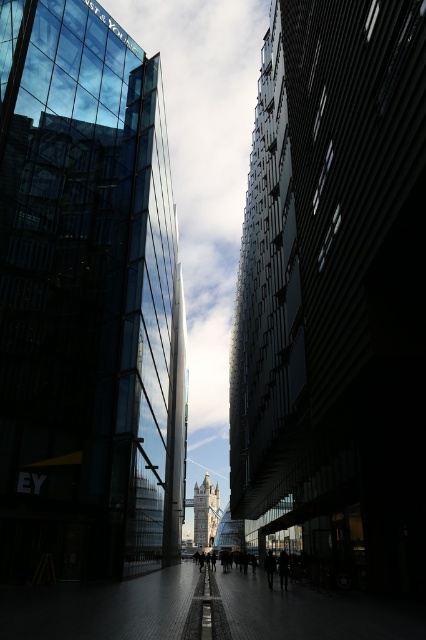
You are standing between two tall buildings and looking up. There are two points marked in the scene, point (285, 564) and point (271, 556). Which point is closer to you?

Point (285, 564) is closer to the viewer than point (271, 556).

You are standing on the sidewalk in front of the dark glass skyscraper at center. You want to take a photo of it with your smartphone, which has a maximum focus distance of 100 feet. Will your phone be able to focus on the skyscraper?

The dark glass skyscraper at center is 151.15 feet away from the viewer. Since the phone has a maximum focus distance of 100 feet, it cannot focus on the skyscraper at this distance.

You are a photographer standing at the base of the transparent glass tower at center. You want to take a photo of the building. Considering the distance between you and the tower, is it possible to capture the entire structure in one shot without moving the camera? Explain your reasoning.

The transparent glass tower at center and camera are 63.27 meters apart from each other. At this distance, it is possible to capture the entire structure in one shot without moving the camera, provided the photographer uses a wide enough lens to accommodate the building height and width within the frame.